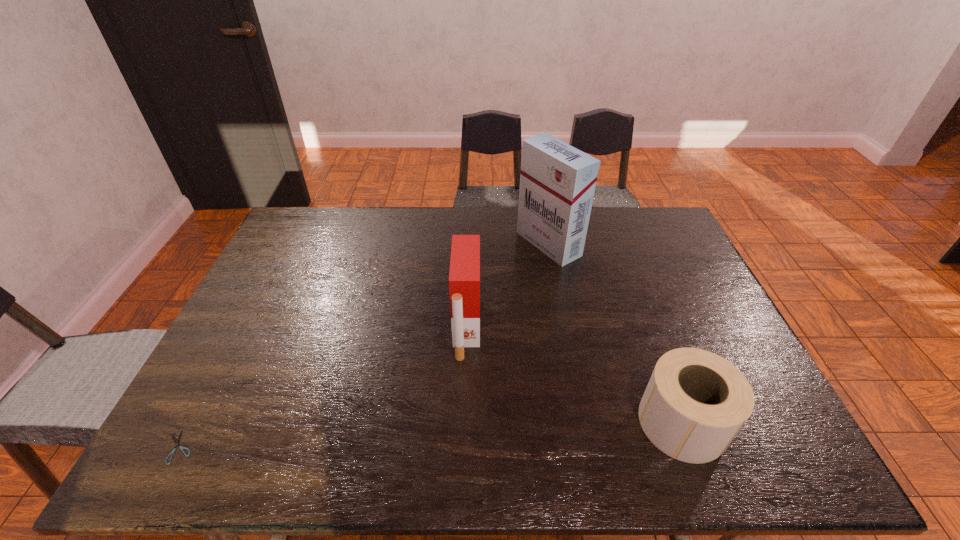
Locate an element on the screen. free location that satisfies the following two spatial constraints: 1. on the front side of the taller cigarette case; 2. on the left side of the rightmost object is located at coordinates (582, 422).

This screenshot has height=540, width=960. I want to click on vacant region that satisfies the following two spatial constraints: 1. on the front-facing side of the third nearest object; 2. on the front side of the shortest object, so click(x=464, y=447).